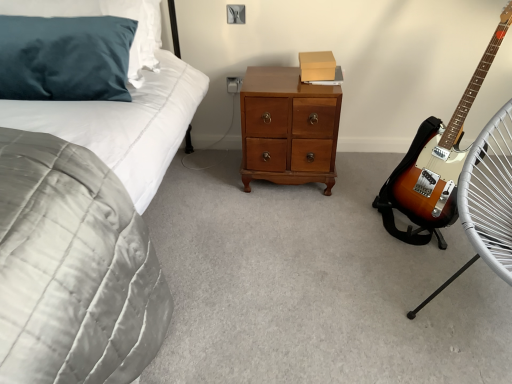
The width and height of the screenshot is (512, 384). In order to click on free spot in front of shiny brown wooden chest of drawers at center in this screenshot , I will do `click(288, 216)`.